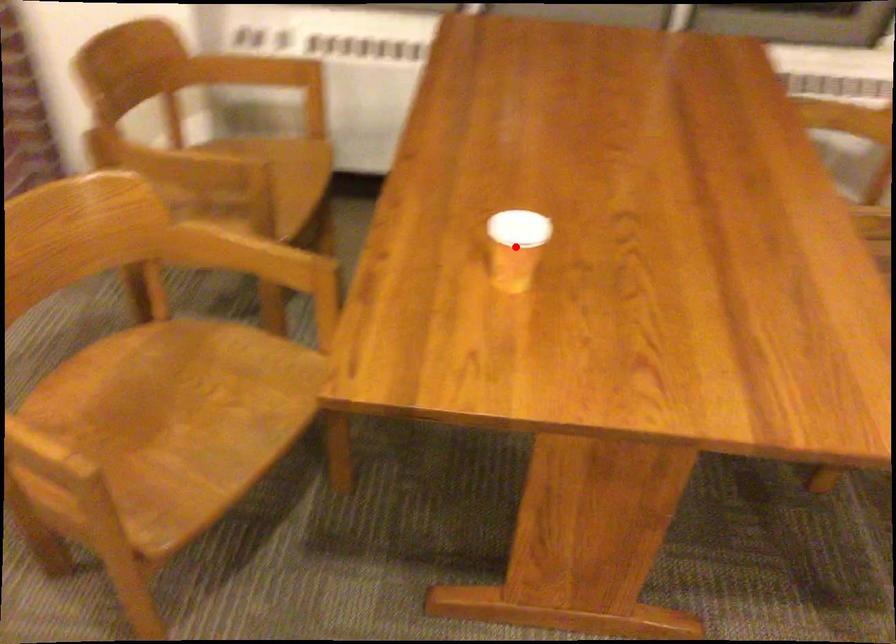
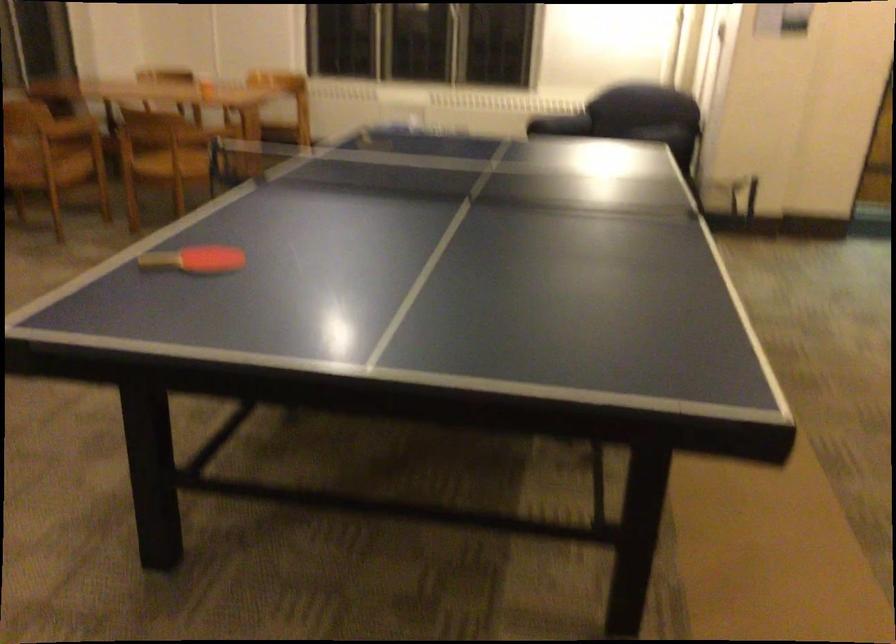
Question: I am providing you with two images of the same scene from different viewpoints. A red point is marked on the first image. At the location where the point appears in image 1, is it still visible in image 2?

Choices:
 (A) Yes
 (B) No

Answer: (B)